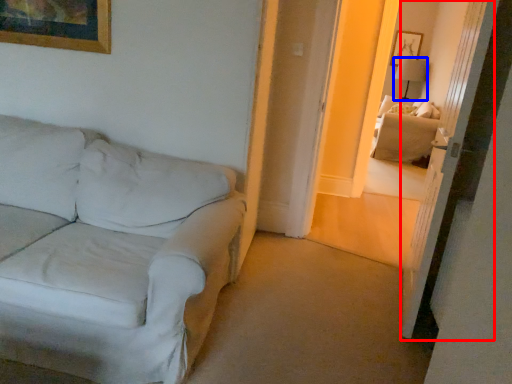
Question: Which of the following is the closest to the observer, glass door (highlighted by a red box) or table lamp (highlighted by a blue box)?

Choices:
 (A) glass door
 (B) table lamp

Answer: (A)